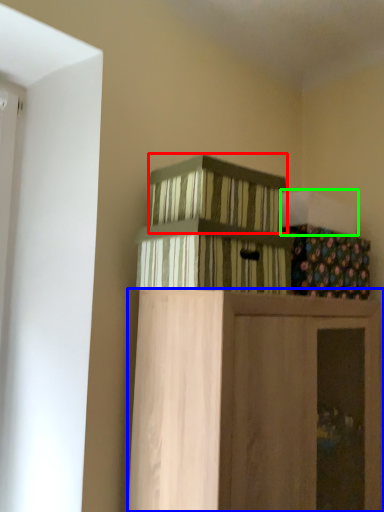
Question: Which is farther away from crate (highlighted by a red box)? furniture (highlighted by a blue box) or box (highlighted by a green box)?

Choices:
 (A) furniture
 (B) box

Answer: (A)